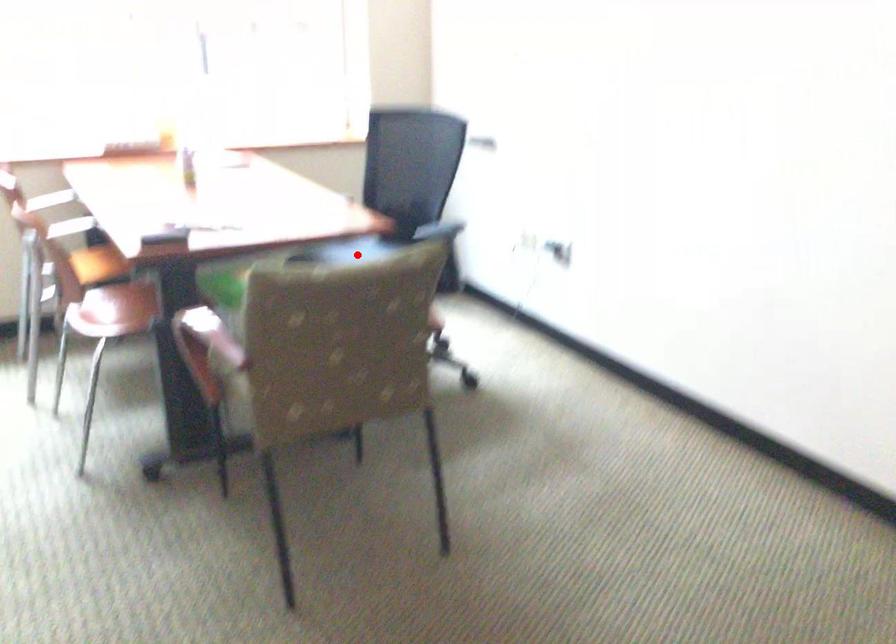
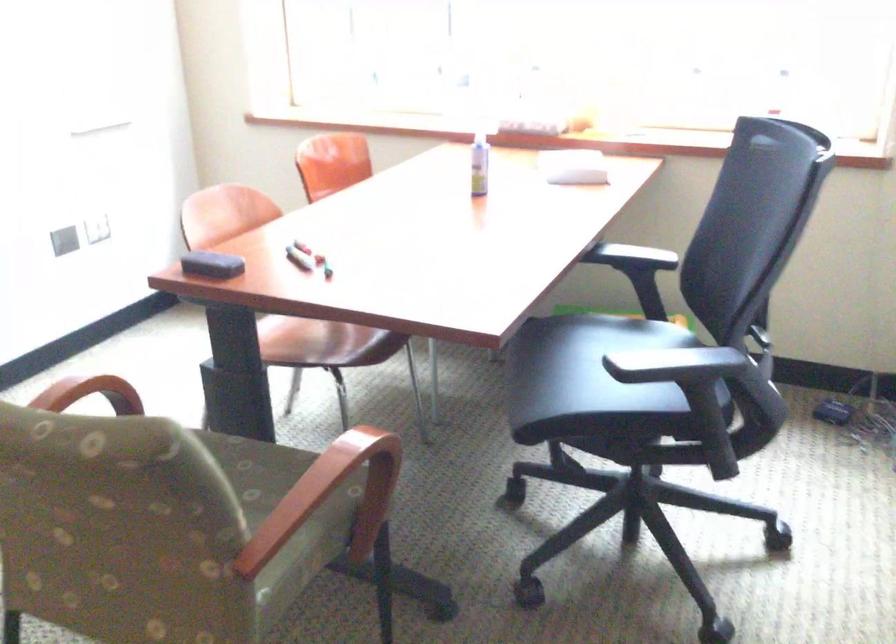
Find the pixel in the second image that matches the highlighted location in the first image.

(591, 361)